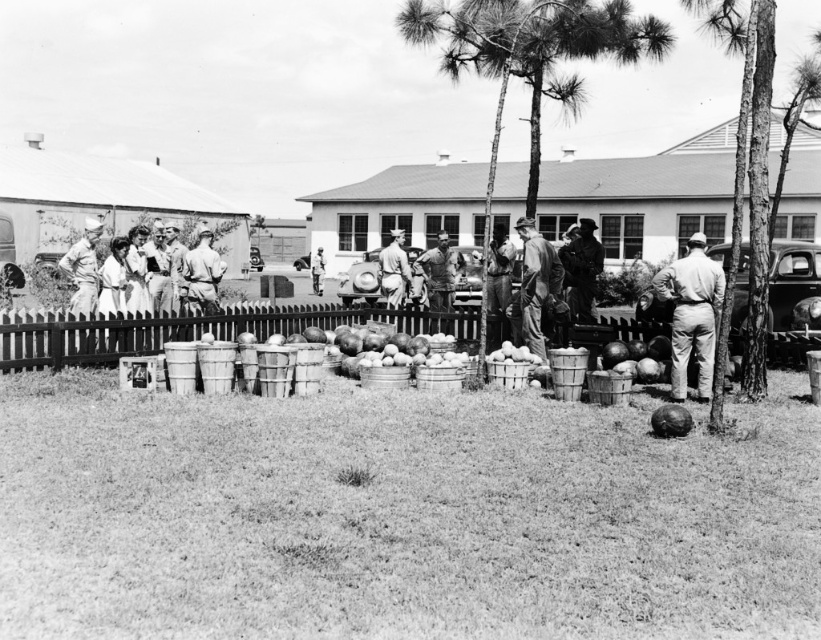
Is light brown fabric pants at right taller than smooth wooden basket at center?

Correct, light brown fabric pants at right is much taller as smooth wooden basket at center.

Can you confirm if light brown fabric pants at right is positioned below smooth wooden basket at center?

No, light brown fabric pants at right is not below smooth wooden basket at center.

Locate an element on the screen. light brown fabric pants at right is located at coordinates (691, 314).

Does light brown fabric pants at right have a lesser width compared to rustic wood crate at center?

Incorrect, light brown fabric pants at right's width is not less than rustic wood crate at center's.

Is light brown fabric pants at right further to camera compared to rustic wood crate at center?

That is False.

Where is `light brown fabric pants at right`? light brown fabric pants at right is located at coordinates (691, 314).

Where is `light brown fabric pants at right`? The image size is (821, 640). light brown fabric pants at right is located at coordinates (691, 314).

Is smooth leather jacket at center further to the viewer compared to light blue uniform at center?

No, it is in front of light blue uniform at center.

Does smooth leather jacket at center have a larger size compared to light blue uniform at center?

Actually, smooth leather jacket at center might be smaller than light blue uniform at center.

Is point (427, 250) farther from camera compared to point (315, 259)?

No, it is in front of (315, 259).

Locate an element on the screen. smooth leather jacket at center is located at coordinates (439, 273).